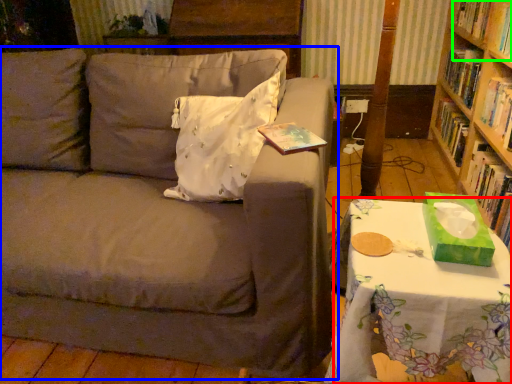
Question: Which object is positioned farthest from table (highlighted by a red box)? Select from studio couch (highlighted by a blue box) and book (highlighted by a green box).

Choices:
 (A) studio couch
 (B) book

Answer: (B)